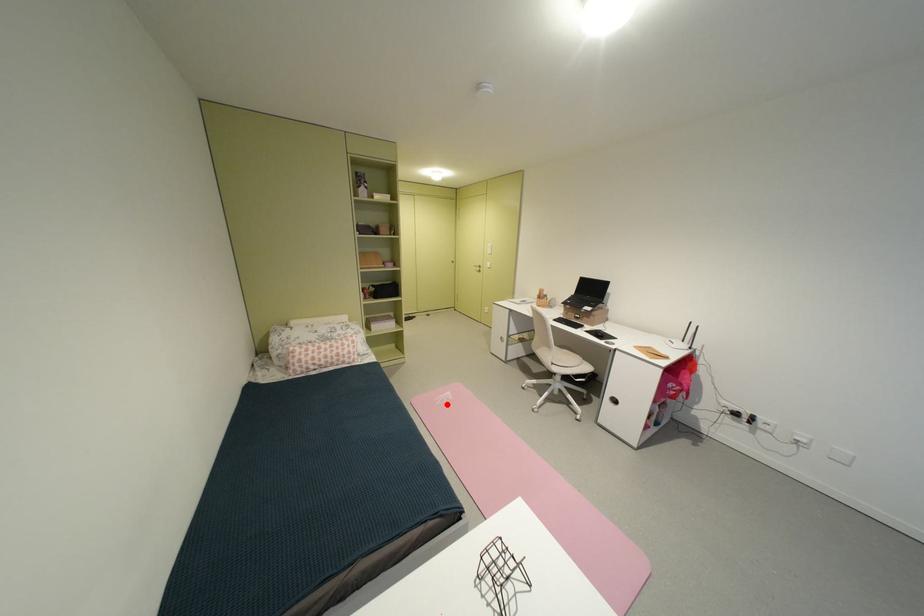
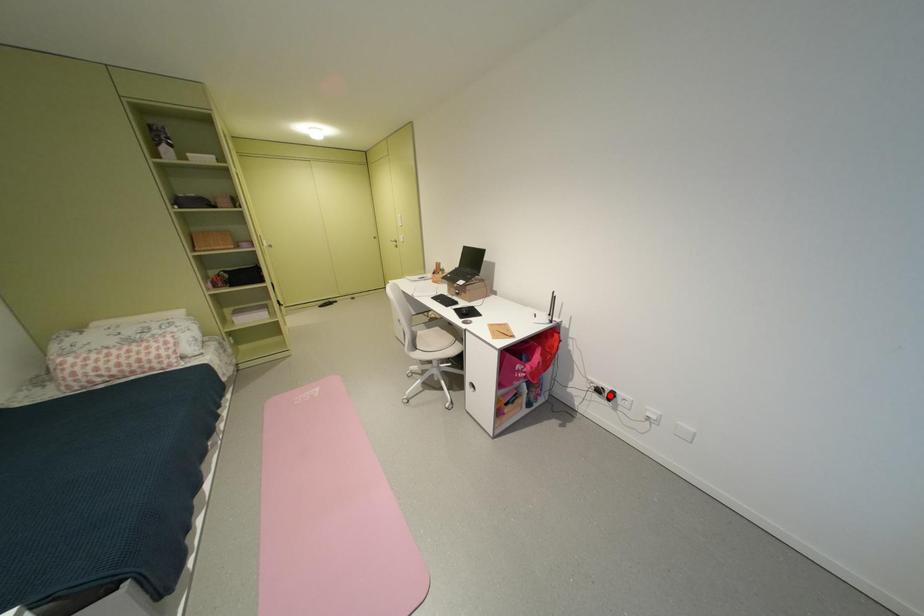
I am providing you with two images of the same scene from different viewpoints. A red point is marked on the first image and another point is marked on the second image. Is the red point in image1 aligned with the point shown in image2?

No